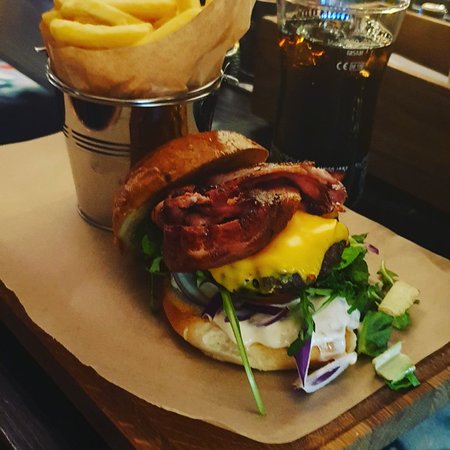
In order to click on glass in this screenshot , I will do `click(361, 32)`.